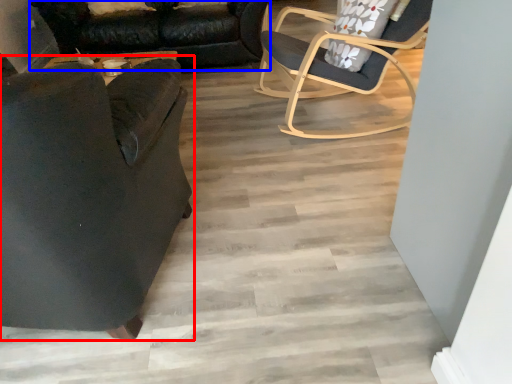
Question: Among these objects, which one is nearest to the camera, chair (highlighted by a red box) or studio couch (highlighted by a blue box)?

Choices:
 (A) chair
 (B) studio couch

Answer: (A)